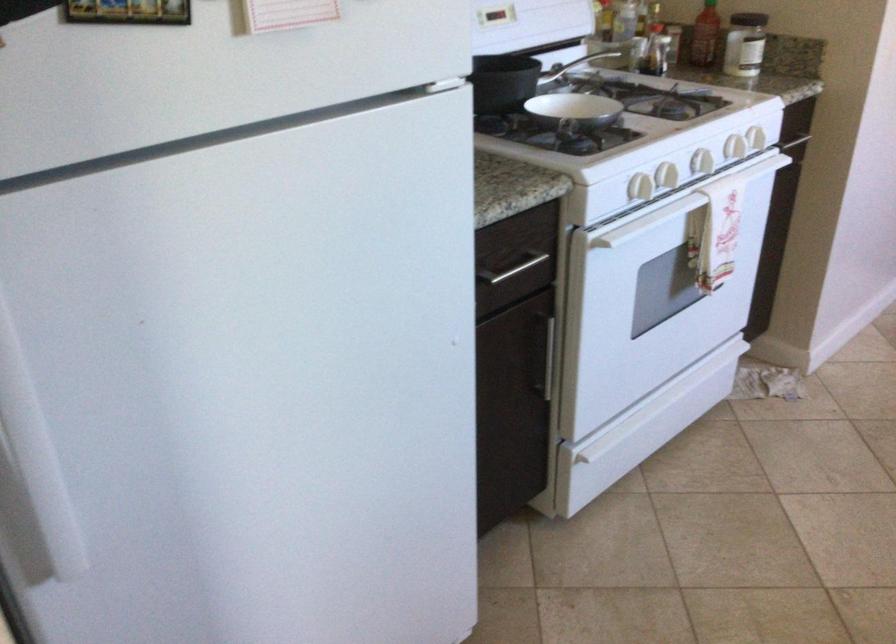
This screenshot has height=644, width=896. I want to click on black pot handle, so click(x=574, y=64).